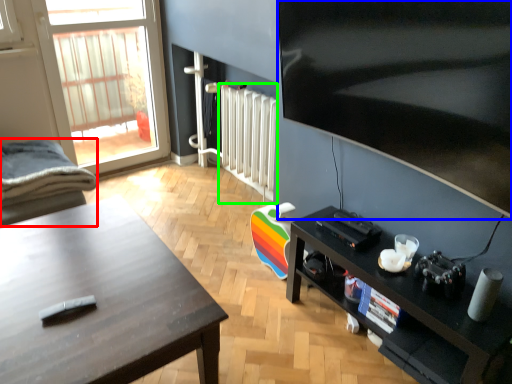
Question: Estimate the real-world distances between objects in this image. Which object is closer to chair (highlighted by a red box), television (highlighted by a blue box) or radiator (highlighted by a green box)?

Choices:
 (A) television
 (B) radiator

Answer: (B)